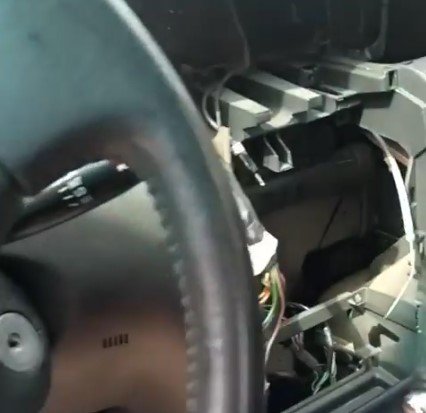
In order to click on under dashboard in this screenshot , I will do tap(283, 361).